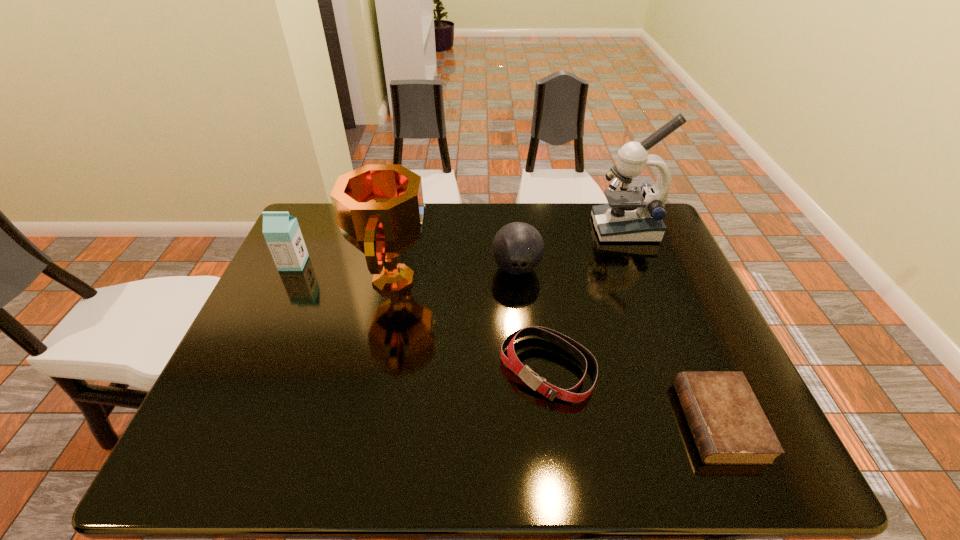
You are a GUI agent. You are given a task and a screenshot of the screen. Output one action in this format:
    pyautogui.click(x=<x>, y=<y>)
    Task: Click on the microscope located in the right edge section of the desktop
    Image resolution: width=960 pixels, height=540 pixels.
    Given the screenshot: What is the action you would take?
    pyautogui.click(x=632, y=215)

Locate an element on the screen. The image size is (960, 540). diary that is at the right edge is located at coordinates (729, 427).

I want to click on object at the far right corner, so click(632, 215).

Identify the location of object at the near right corner. This screenshot has height=540, width=960. (729, 427).

The height and width of the screenshot is (540, 960). Identify the location of free region at the far edge of the desktop. (491, 245).

Identify the location of free space at the near edge of the desktop. Image resolution: width=960 pixels, height=540 pixels. (491, 454).

Identify the location of vacant space at the left edge. This screenshot has height=540, width=960. (296, 272).

You are a GUI agent. You are given a task and a screenshot of the screen. Output one action in this format:
    pyautogui.click(x=<x>, y=<y>)
    Task: Click on the vacant space at the right edge of the desktop
    Image resolution: width=960 pixels, height=540 pixels.
    Given the screenshot: What is the action you would take?
    pyautogui.click(x=670, y=299)

Where is `free space at the near left corner of the desktop`? free space at the near left corner of the desktop is located at coordinates (236, 441).

I want to click on empty space that is in between the second tallest object and the bowling ball, so click(x=456, y=274).